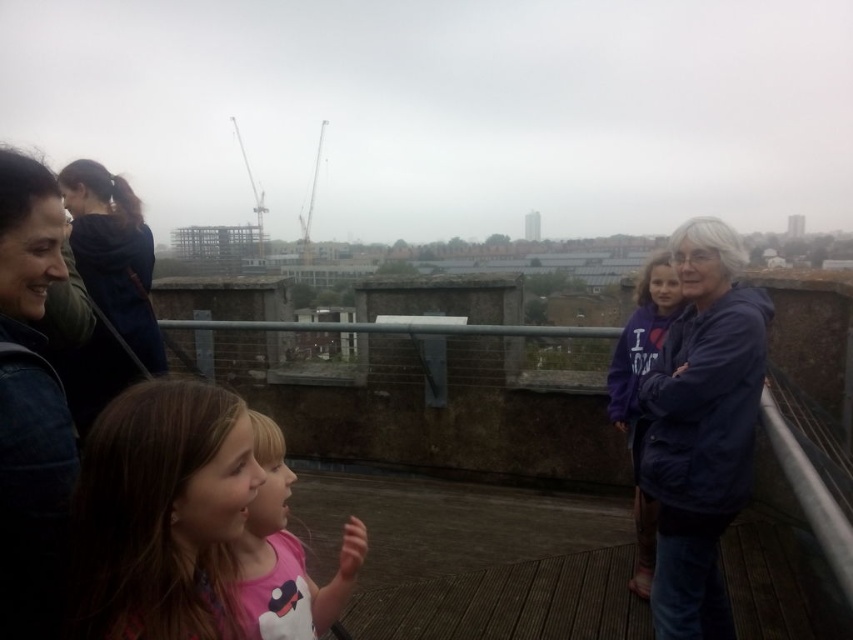
Question: Which of these objects is positioned closest to the dark blue denim jacket at left?

Choices:
 (A) navy blue jacket at right
 (B) dark blue hoodie at upper left

Answer: (B)

Question: Is dark blue denim jacket at left above purple fleece jacket at right?

Choices:
 (A) yes
 (B) no

Answer: (A)

Question: Which object appears farthest from the camera in this image?

Choices:
 (A) dark blue denim jacket at left
 (B) dark blue hoodie at upper left
 (C) smooth brown hair at lower left
 (D) purple fleece jacket at right

Answer: (D)

Question: Is smooth brown hair at lower left behind pink fabric shirt at lower left?

Choices:
 (A) no
 (B) yes

Answer: (A)

Question: Is dark blue denim jacket at left closer to the viewer compared to pink fabric shirt at lower left?

Choices:
 (A) no
 (B) yes

Answer: (B)

Question: Which of the following is the farthest from the observer?

Choices:
 (A) (12, 531)
 (B) (633, 356)
 (C) (134, 461)
 (D) (103, 221)

Answer: (D)